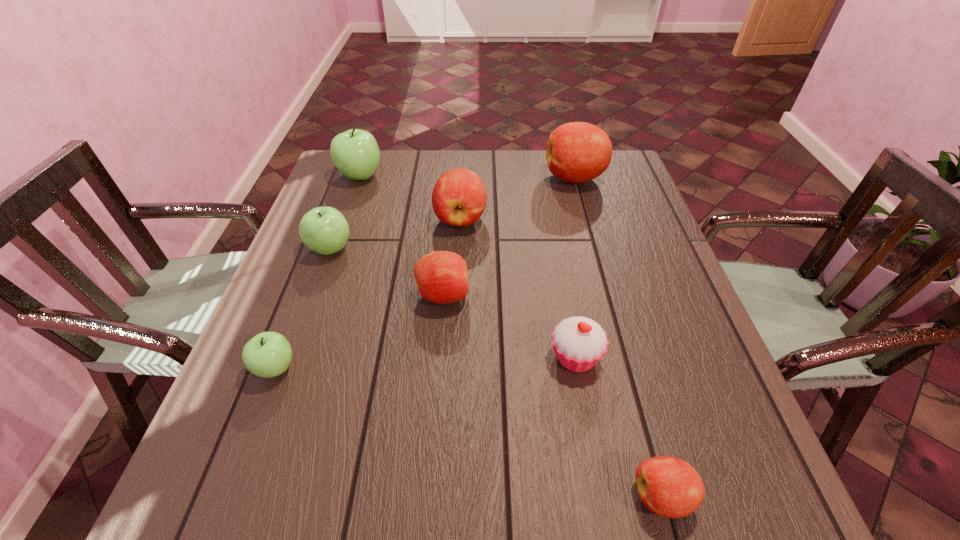
At what (x,y) coordinates should I click in order to perform the action: click on the farthest red apple. Please return your answer as a coordinate pair (x, y). The height and width of the screenshot is (540, 960). Looking at the image, I should click on (576, 152).

Locate an element on the screen. Image resolution: width=960 pixels, height=540 pixels. the farthest green apple is located at coordinates (355, 153).

Find the location of a particular element. the second farthest red apple is located at coordinates (459, 197).

This screenshot has height=540, width=960. What are the coordinates of `the second farthest green apple` in the screenshot? It's located at (324, 230).

Identify the location of the fourth nearest object. (441, 276).

Where is `the fifth farthest apple`? the fifth farthest apple is located at coordinates (441, 276).

This screenshot has width=960, height=540. I want to click on cupcake, so click(579, 343).

Find the location of `the smallest green apple`. the smallest green apple is located at coordinates (268, 354).

This screenshot has height=540, width=960. I want to click on the second nearest apple, so coord(268,354).

Where is `the nearest apple`? This screenshot has width=960, height=540. the nearest apple is located at coordinates (668, 486).